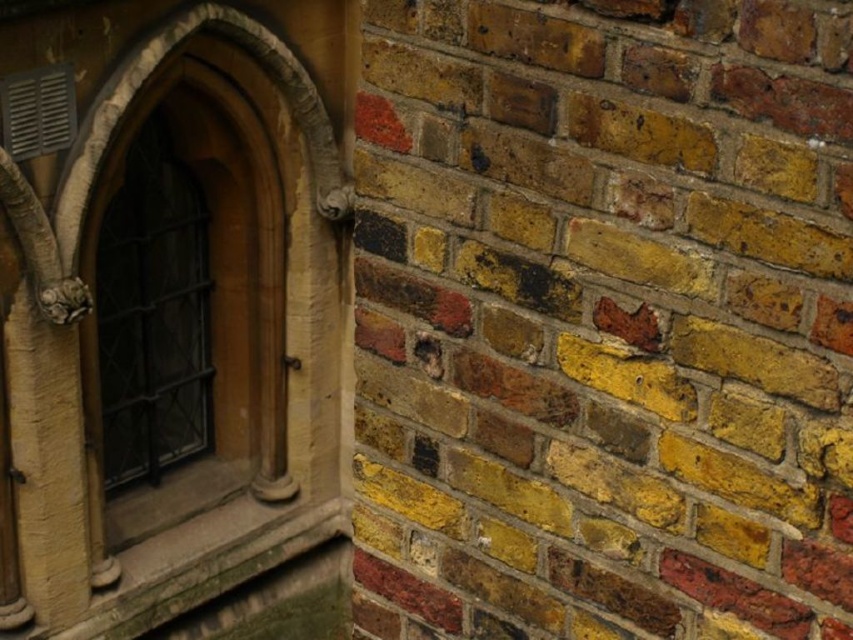
Question: Is yellow brick wall at center smaller than dark brown wooden window at left?

Choices:
 (A) no
 (B) yes

Answer: (B)

Question: Can you confirm if yellow brick wall at center is wider than dark brown wooden window at left?

Choices:
 (A) yes
 (B) no

Answer: (A)

Question: Does yellow brick wall at center appear on the right side of dark brown wooden window at left?

Choices:
 (A) no
 (B) yes

Answer: (B)

Question: Which of the following is the farthest from the observer?

Choices:
 (A) (146, 289)
 (B) (469, 342)

Answer: (A)